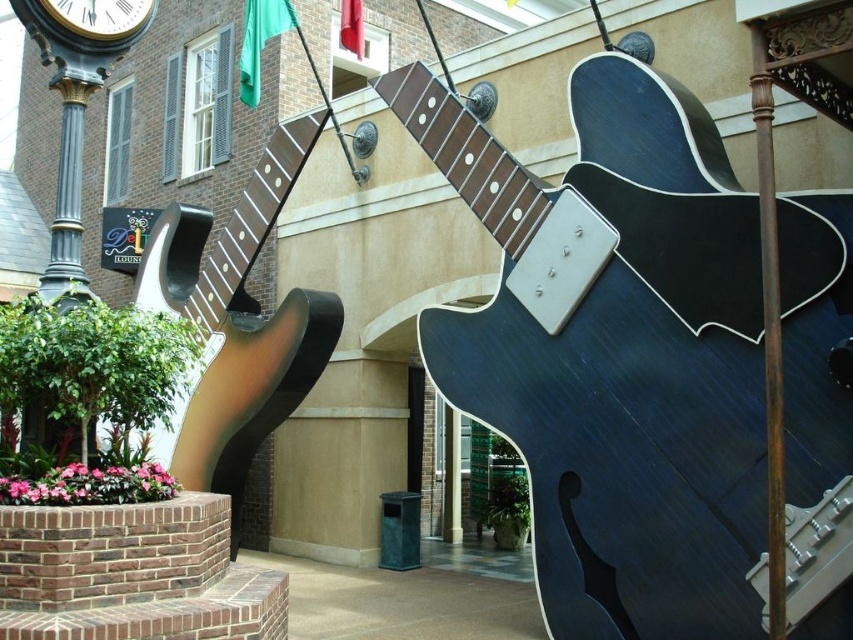
Question: Estimate the real-world distances between objects in this image. Which object is closer to the glossy dark blue guitar at center?

Choices:
 (A) metallic gold clock at upper left
 (B) wooden guitar at center

Answer: (B)

Question: Can you confirm if glossy dark blue guitar at center is wider than metallic gold clock at upper left?

Choices:
 (A) no
 (B) yes

Answer: (B)

Question: In this image, where is glossy dark blue guitar at center located relative to metallic gold clock at upper left?

Choices:
 (A) above
 (B) below

Answer: (B)

Question: Which object is the closest to the metallic gold clock at upper left?

Choices:
 (A) wooden guitar at center
 (B) glossy dark blue guitar at center

Answer: (A)

Question: Which of these objects is positioned closest to the wooden guitar at center?

Choices:
 (A) metallic gold clock at upper left
 (B) glossy dark blue guitar at center

Answer: (B)

Question: From the image, what is the correct spatial relationship of wooden guitar at center in relation to metallic gold clock at upper left?

Choices:
 (A) below
 (B) above

Answer: (A)